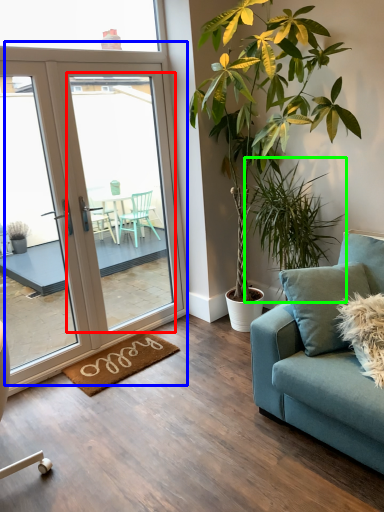
Question: Considering the real-world distances, which object is farthest from screen door (highlighted by a red box)? door (highlighted by a blue box) or houseplant (highlighted by a green box)?

Choices:
 (A) door
 (B) houseplant

Answer: (B)